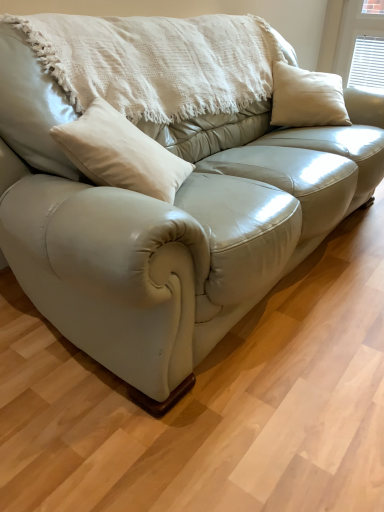
The image size is (384, 512). Describe the element at coordinates (157, 62) in the screenshot. I see `white textured blanket at upper center` at that location.

In order to face white textured blanket at upper center, should I rotate leftwards or rightwards?

You should rotate left by 2.473 degrees.

What is the approximate height of white textured blanket at upper center?

The height of white textured blanket at upper center is 15.74 inches.

This screenshot has width=384, height=512. I want to click on white textured blanket at upper center, so click(x=157, y=62).

Find the location of a particular element. The image size is (384, 512). white textured blanket at upper center is located at coordinates (157, 62).